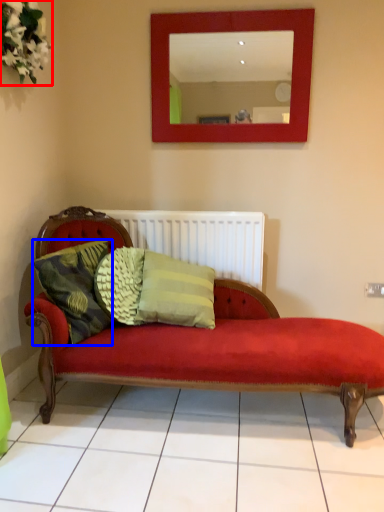
Question: Which of the following is the closest to the observer, floral arrangement (highlighted by a red box) or pillow (highlighted by a blue box)?

Choices:
 (A) floral arrangement
 (B) pillow

Answer: (A)